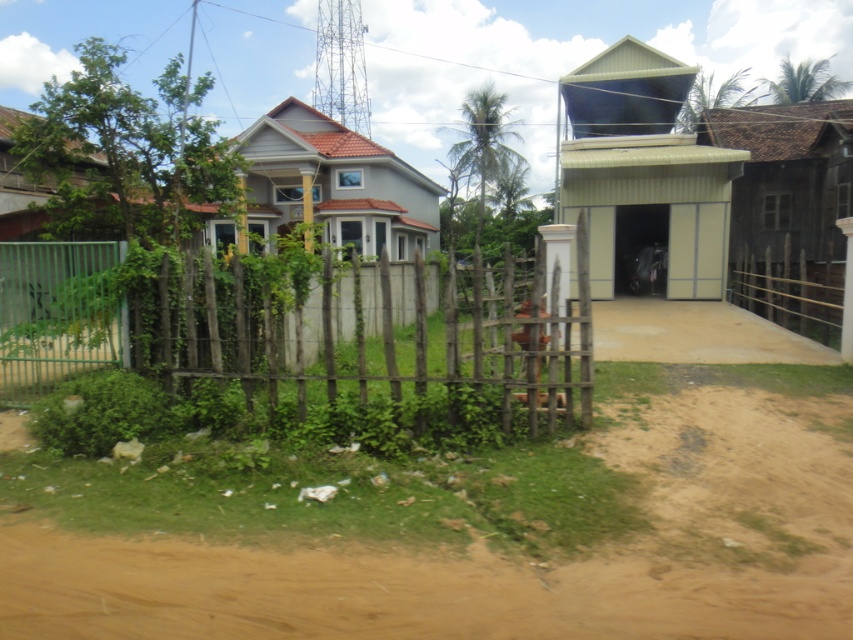
Question: Can you confirm if brown dirt field at lower left is wider than metallic corrugated hut at upper right?

Choices:
 (A) no
 (B) yes

Answer: (B)

Question: Does green wooden fence at left have a lesser width compared to wooden hut at right?

Choices:
 (A) yes
 (B) no

Answer: (A)

Question: Which of these objects is positioned closest to the brown dirt field at lower left?

Choices:
 (A) wooden hut at right
 (B) metallic corrugated hut at upper right

Answer: (B)

Question: Estimate the real-world distances between objects in this image. Which object is closer to the metallic corrugated hut at upper right?

Choices:
 (A) brown dirt field at lower left
 (B) green wooden fence at left
 (C) matte gray house at center

Answer: (C)

Question: Which is farther from the wooden hut at right?

Choices:
 (A) brown dirt field at lower left
 (B) green wooden fence at left

Answer: (A)

Question: Is brown dirt field at lower left wider than green wooden fence at left?

Choices:
 (A) yes
 (B) no

Answer: (A)